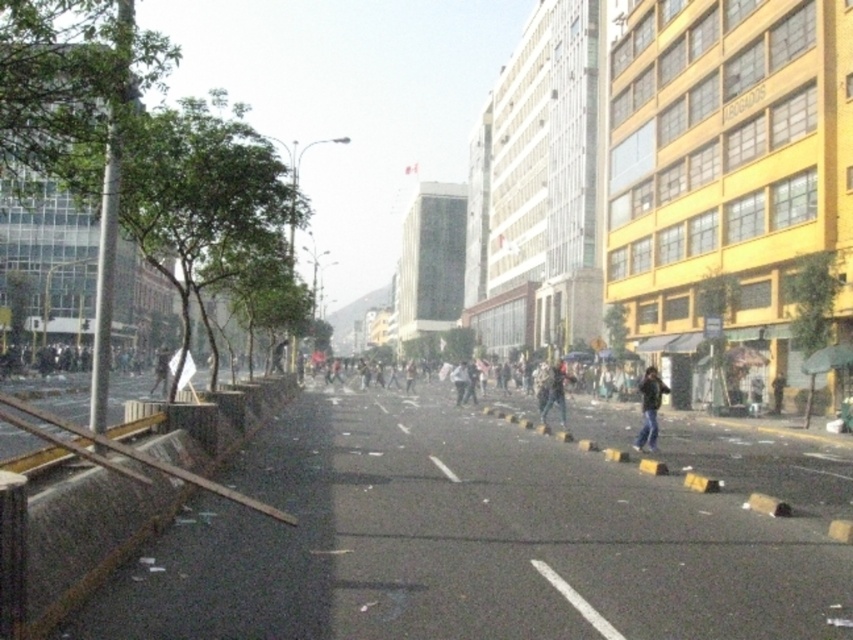
Does wooden barricade at left have a lesser height compared to dark blue jeans at lower right?

Indeed, wooden barricade at left has a lesser height compared to dark blue jeans at lower right.

Can you confirm if wooden barricade at left is thinner than dark blue jeans at lower right?

No.

Where is `wooden barricade at left`? Image resolution: width=853 pixels, height=640 pixels. wooden barricade at left is located at coordinates (115, 499).

Who is more distant from viewer, (x=44, y=540) or (x=466, y=371)?

Point (x=466, y=371)

The height and width of the screenshot is (640, 853). What do you see at coordinates (115, 499) in the screenshot?
I see `wooden barricade at left` at bounding box center [115, 499].

I want to click on wooden barricade at left, so click(x=115, y=499).

Describe the element at coordinates (648, 408) in the screenshot. I see `dark blue jeans at lower right` at that location.

Looking at this image, is dark blue jeans at lower right to the left of camouflage fabric jacket at center from the viewer's perspective?

Correct, you'll find dark blue jeans at lower right to the left of camouflage fabric jacket at center.

Where is `dark blue jeans at lower right`? dark blue jeans at lower right is located at coordinates (648, 408).